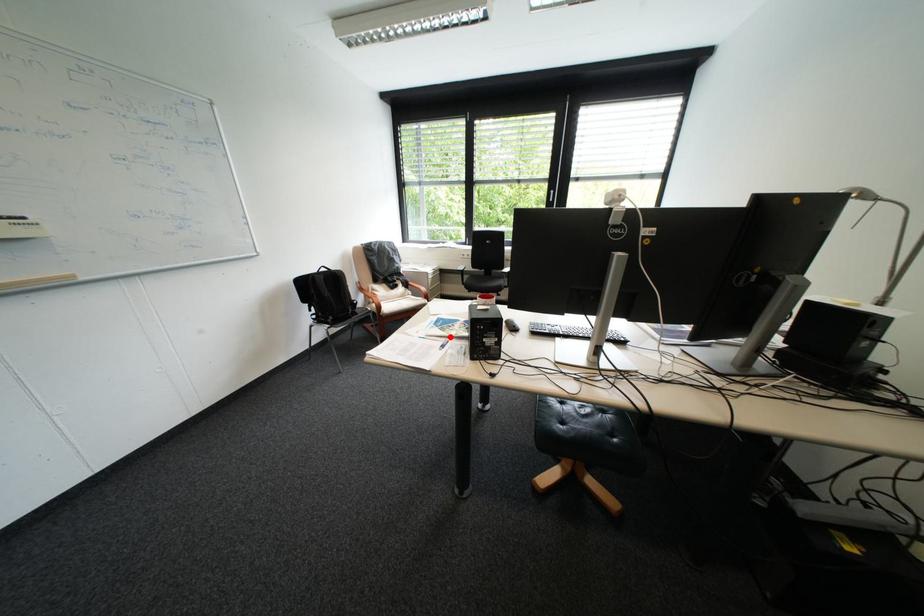
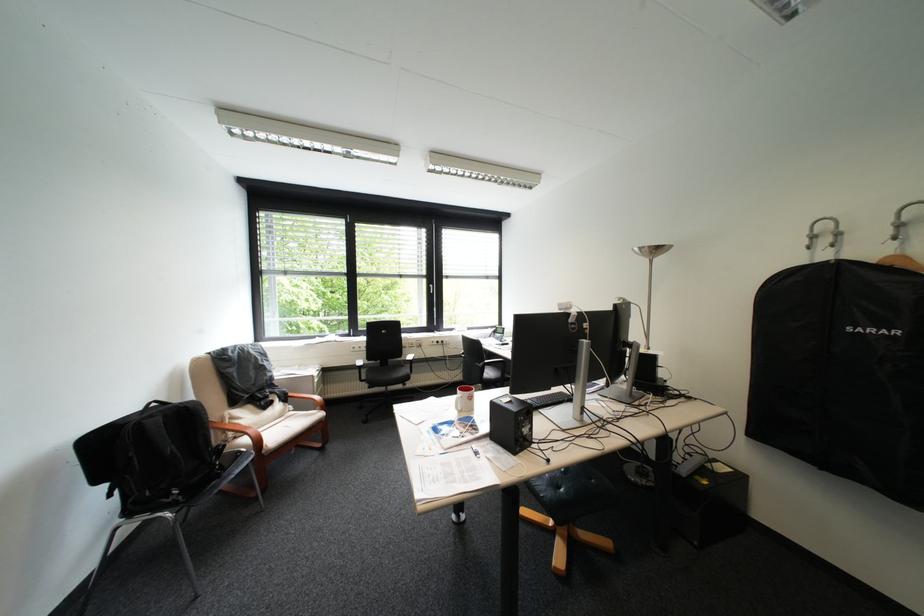
The point at the highlighted location is marked in the first image. Where is the corresponding point in the second image?

(469, 446)